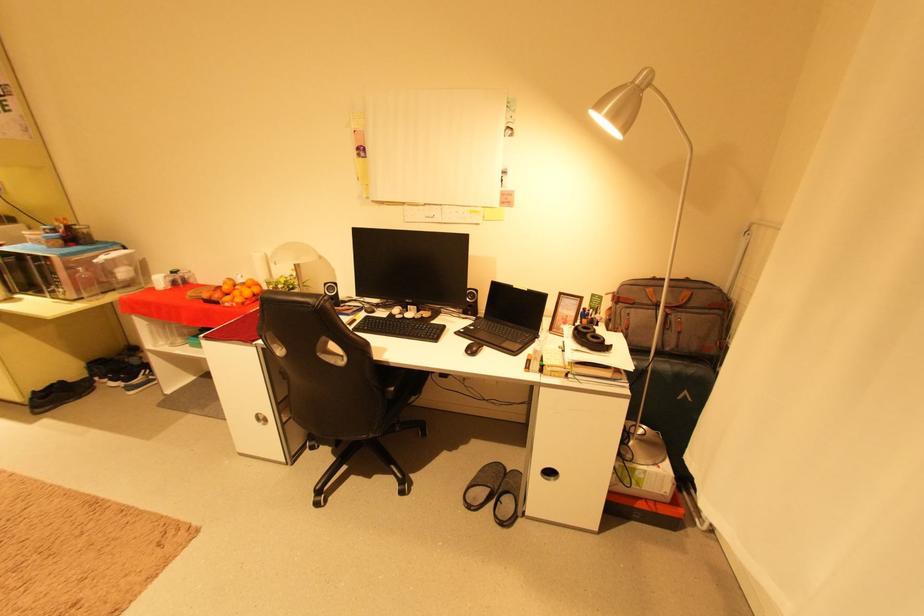
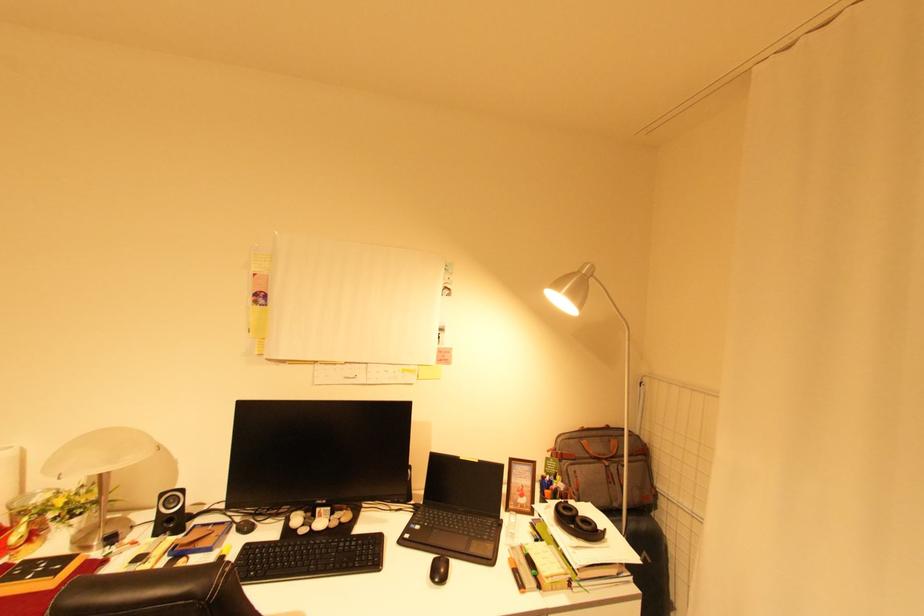
Locate, in the second image, the point that corresponds to point (533, 291) in the first image.

(484, 462)